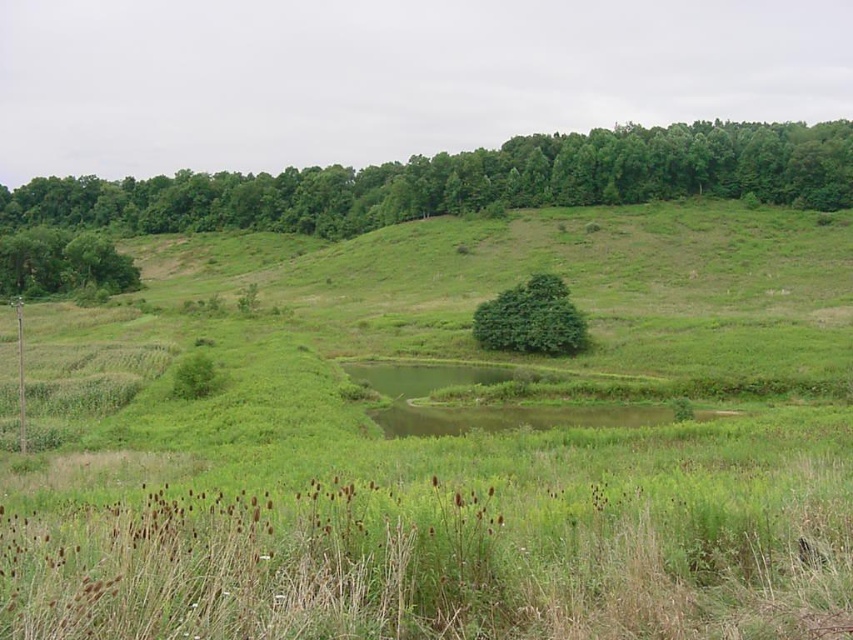
Question: Is green leafy tree at upper center thinner than green leafy tree at center?

Choices:
 (A) no
 (B) yes

Answer: (A)

Question: Is green leafy tree at upper center positioned before green leafy tree at center?

Choices:
 (A) yes
 (B) no

Answer: (B)

Question: Among these objects, which one is nearest to the camera?

Choices:
 (A) green leafy tree at center
 (B) green leafy tree at upper center

Answer: (A)

Question: Is green leafy tree at upper center wider than green leafy tree at center?

Choices:
 (A) no
 (B) yes

Answer: (B)

Question: Which object appears farthest from the camera in this image?

Choices:
 (A) green leafy tree at upper center
 (B) green leafy tree at center

Answer: (A)

Question: Which of the following is the farthest from the observer?

Choices:
 (A) (387, 198)
 (B) (511, 312)

Answer: (A)